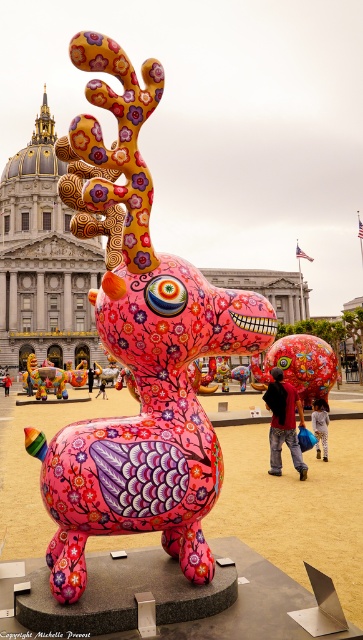
Which is in front, point (83, 525) or point (328, 348)?

Point (83, 525) is in front.

Consider the image. Can you confirm if pink glossy deer at center is positioned to the right of shiny metallic elephant at center?

Incorrect, pink glossy deer at center is not on the right side of shiny metallic elephant at center.

You are a GUI agent. You are given a task and a screenshot of the screen. Output one action in this format:
    pyautogui.click(x=<x>, y=<y>)
    Task: Click on the pink glossy deer at center
    The height and width of the screenshot is (640, 363).
    Given the screenshot: What is the action you would take?
    pos(139,349)

You are a GUI agent. You are given a task and a screenshot of the screen. Output one action in this format:
    pyautogui.click(x=<x>, y=<y>)
    Task: Click on the pink glossy deer at center
    This screenshot has height=640, width=363.
    Given the screenshot: What is the action you would take?
    pyautogui.click(x=139, y=349)